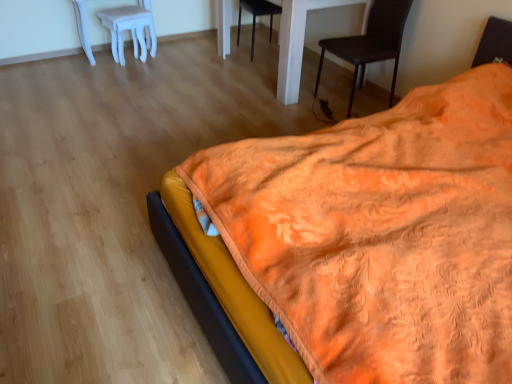
The height and width of the screenshot is (384, 512). I want to click on free area below black leather chair at upper right, which appears as the first chair when viewed from the front (from a real-world perspective), so click(x=350, y=104).